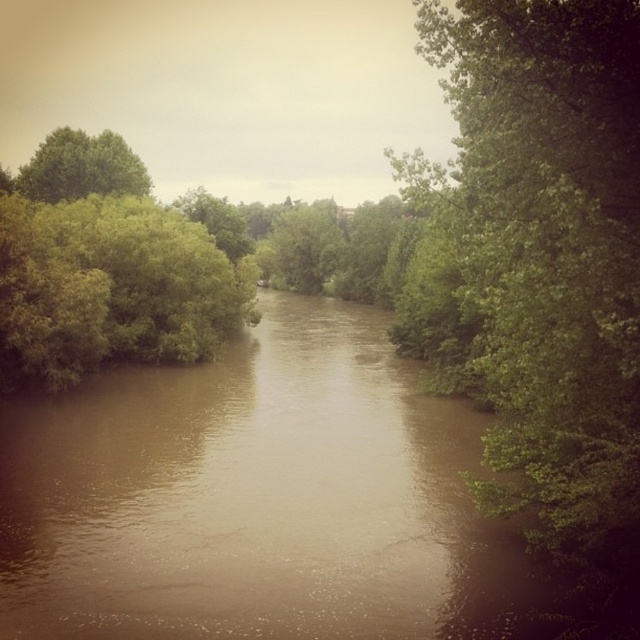
You are a hiker who wants to cross the river but needs to stay within a 100 meter distance between two landmarks for safety. You see the green leafy tree at upper left and the green leafy tree at center. Can you safely cross the river using these two trees as landmarks?

The green leafy tree at upper left and the green leafy tree at center are 68.77 meters apart from each other. Since this distance is within the 100 meter safety limit, you can safely cross the river using these two trees as landmarks.

Looking at this image, you are standing at the center of the river and see a point marked at coordinates (x=548, y=248). Which object in the scene does this point belong to?

The point at coordinates (x=548, y=248) is on the green leafy tree at right.

You are standing in the middle of the river and see the green leafy tree at right and the green leafy tree at upper left. Which tree is closer to your right side?

The green leafy tree at right is positioned on the right side of green leafy tree at upper left, so the green leafy tree at right is closer to your right side.